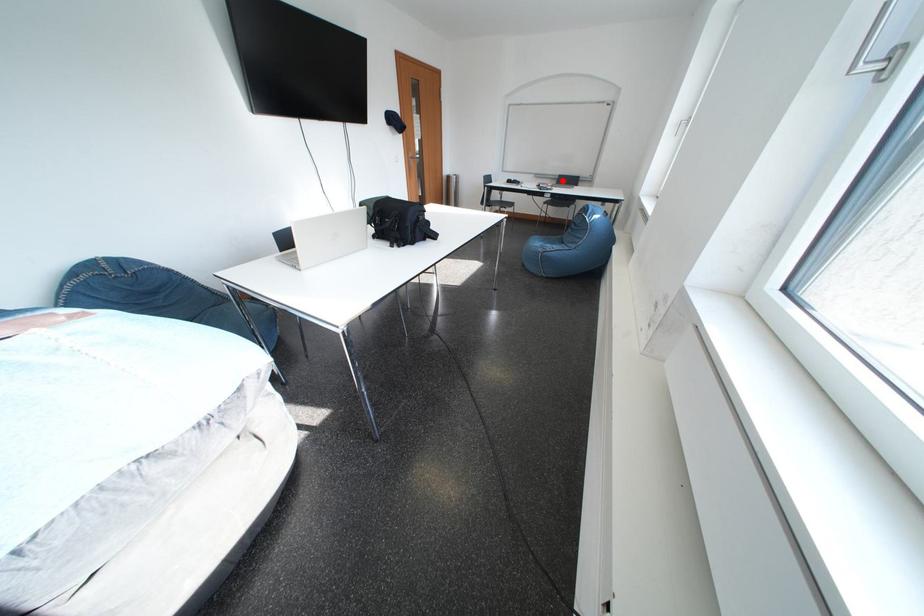
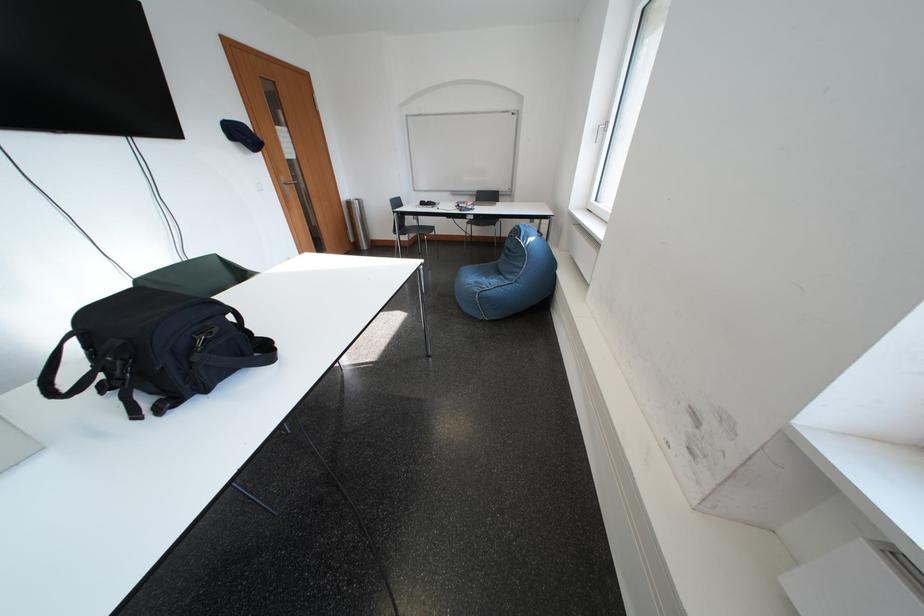
Locate, in the second image, the point that corresponds to the highlighted location in the first image.

(480, 198)